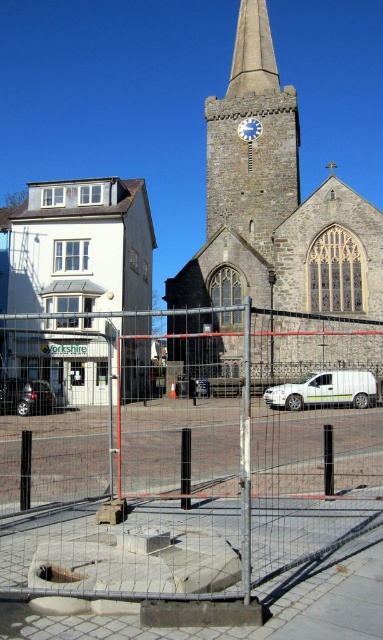
Question: Which object is farther from the camera taking this photo?

Choices:
 (A) stone church at center
 (B) blue metallic clock at center

Answer: (B)

Question: Which object is farther from the camera taking this photo?

Choices:
 (A) blue metallic clock at center
 (B) metal mesh fence at center
 (C) shiny black car at lower left
 (D) white matte building at left

Answer: (A)

Question: Does white matte van at center have a greater width compared to shiny black car at lower left?

Choices:
 (A) yes
 (B) no

Answer: (A)

Question: Which point is closer to the camera?

Choices:
 (A) (256, 122)
 (B) (68, 387)

Answer: (B)

Question: Is shiny black car at lower left positioned behind blue metallic clock at center?

Choices:
 (A) yes
 (B) no

Answer: (B)

Question: Is shiny black car at lower left positioned before blue metallic clock at center?

Choices:
 (A) no
 (B) yes

Answer: (B)